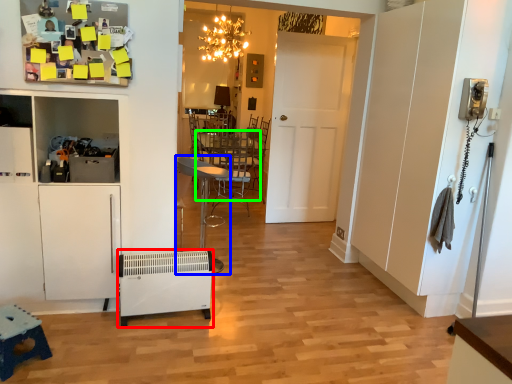
Question: Which is nearer to the appliance (highlighted by a red box)? chair (highlighted by a blue box) or table (highlighted by a green box).

Choices:
 (A) chair
 (B) table

Answer: (A)